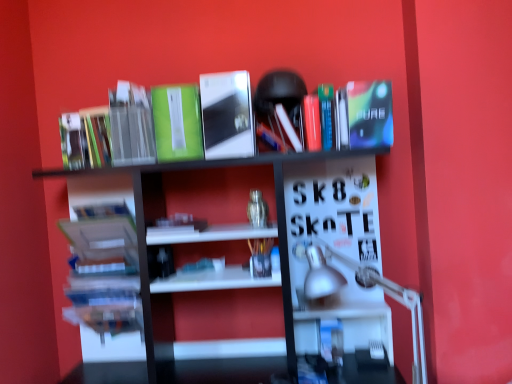
Question: From the image's perspective, is matte green book at upper left, the first book when ordered from left to right, below green matte book at upper left, positioned as the fourth paperback book in right-to-left order?

Choices:
 (A) yes
 (B) no

Answer: (A)

Question: Is matte green book at upper left, which is counted as the 5th book, starting from the right, touching green matte book at upper left, positioned as the fourth paperback book in right-to-left order?

Choices:
 (A) no
 (B) yes

Answer: (A)

Question: Can you confirm if matte green book at upper left, the first book when ordered from left to right, is bigger than green matte book at upper left, positioned as the fourth paperback book in right-to-left order?

Choices:
 (A) yes
 (B) no

Answer: (B)

Question: From a real-world perspective, does matte green book at upper left, the first book when ordered from left to right, sit lower than green matte book at upper left, positioned as the fourth paperback book in right-to-left order?

Choices:
 (A) no
 (B) yes

Answer: (B)

Question: Is matte green book at upper left, the first book when ordered from left to right, positioned far away from green matte book at upper left, which appears as the 1th paperback book when viewed from the left?

Choices:
 (A) yes
 (B) no

Answer: (B)

Question: Is matte green book at upper left, which is counted as the 5th book, starting from the right, taller than green matte book at upper left, positioned as the fourth paperback book in right-to-left order?

Choices:
 (A) yes
 (B) no

Answer: (B)

Question: Considering the relative sizes of silver metallic table lamp at lower right and green matte book at upper center, the third paperback book from the right, in the image provided, is silver metallic table lamp at lower right shorter than green matte book at upper center, the third paperback book from the right,?

Choices:
 (A) no
 (B) yes

Answer: (A)

Question: Is silver metallic table lamp at lower right further to camera compared to green matte book at upper center, which ranks as the 2th paperback book in left-to-right order?

Choices:
 (A) yes
 (B) no

Answer: (B)

Question: From a real-world perspective, is silver metallic table lamp at lower right on green matte book at upper center, which ranks as the 2th paperback book in left-to-right order?

Choices:
 (A) yes
 (B) no

Answer: (B)

Question: Can you confirm if silver metallic table lamp at lower right is thinner than green matte book at upper center, the third paperback book from the right?

Choices:
 (A) no
 (B) yes

Answer: (A)

Question: Considering the relative sizes of silver metallic table lamp at lower right and green matte book at upper center, the third paperback book from the right, in the image provided, is silver metallic table lamp at lower right bigger than green matte book at upper center, the third paperback book from the right,?

Choices:
 (A) yes
 (B) no

Answer: (A)

Question: Is silver metallic table lamp at lower right turned away from green matte book at upper center, which ranks as the 2th paperback book in left-to-right order?

Choices:
 (A) no
 (B) yes

Answer: (A)

Question: Does translucent plastic pen holder at center, which appears as the 5th book when viewed from the left, come in front of white glossy bookshelf at upper center?

Choices:
 (A) no
 (B) yes

Answer: (A)